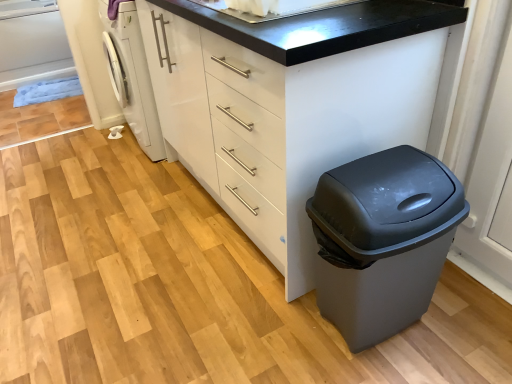
Question: Could you tell me if white glossy washing machine at left is facing white glossy sink at upper center?

Choices:
 (A) yes
 (B) no

Answer: (B)

Question: Does white glossy washing machine at left have a smaller size compared to white glossy sink at upper center?

Choices:
 (A) no
 (B) yes

Answer: (A)

Question: Is white glossy washing machine at left oriented away from white glossy sink at upper center?

Choices:
 (A) no
 (B) yes

Answer: (A)

Question: Is white glossy washing machine at left at the left side of white glossy sink at upper center?

Choices:
 (A) yes
 (B) no

Answer: (A)

Question: Can you confirm if white glossy washing machine at left is bigger than white glossy sink at upper center?

Choices:
 (A) yes
 (B) no

Answer: (A)

Question: Is white glossy washing machine at left in front of or behind white matte chest of drawers at center in the image?

Choices:
 (A) front
 (B) behind

Answer: (B)

Question: From the image's perspective, is white glossy washing machine at left above or below white matte chest of drawers at center?

Choices:
 (A) below
 (B) above

Answer: (B)

Question: From a real-world perspective, is white glossy washing machine at left physically located above or below white matte chest of drawers at center?

Choices:
 (A) above
 (B) below

Answer: (B)

Question: Considering the positions of white glossy washing machine at left and white matte chest of drawers at center in the image, is white glossy washing machine at left taller or shorter than white matte chest of drawers at center?

Choices:
 (A) tall
 (B) short

Answer: (B)

Question: Is matte gray plastic trash can at lower right in front of or behind white glossy washing machine at left in the image?

Choices:
 (A) behind
 (B) front

Answer: (B)

Question: From the image's perspective, is matte gray plastic trash can at lower right located above or below white glossy washing machine at left?

Choices:
 (A) below
 (B) above

Answer: (A)

Question: Based on their positions, is matte gray plastic trash can at lower right located to the left or right of white glossy washing machine at left?

Choices:
 (A) right
 (B) left

Answer: (A)

Question: Is point (375, 188) positioned closer to the camera than point (142, 57)?

Choices:
 (A) closer
 (B) farther

Answer: (A)

Question: In the image, is white glossy sink at upper center positioned in front of or behind white glossy washing machine at left?

Choices:
 (A) behind
 (B) front

Answer: (B)

Question: Is point (274, 18) positioned closer to the camera than point (118, 97)?

Choices:
 (A) farther
 (B) closer

Answer: (B)